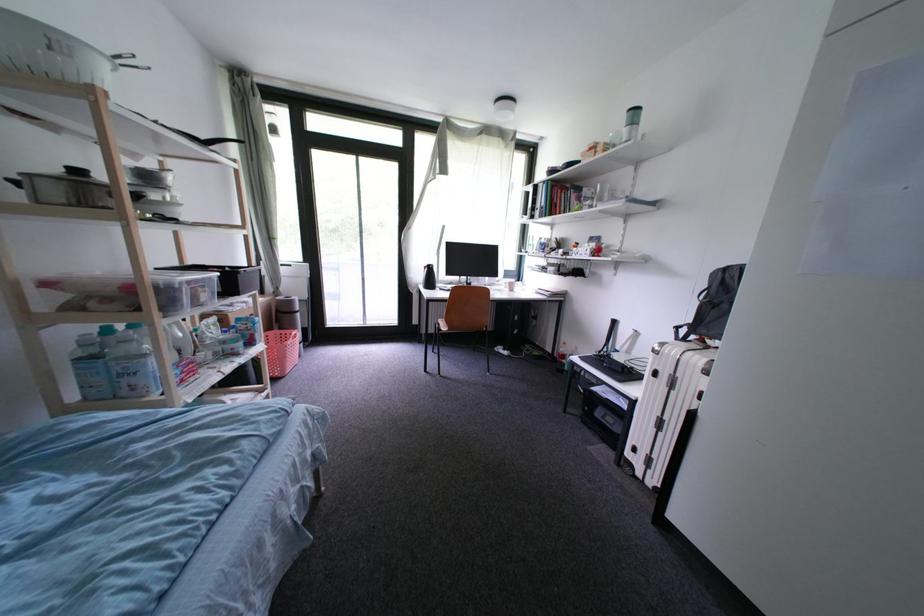
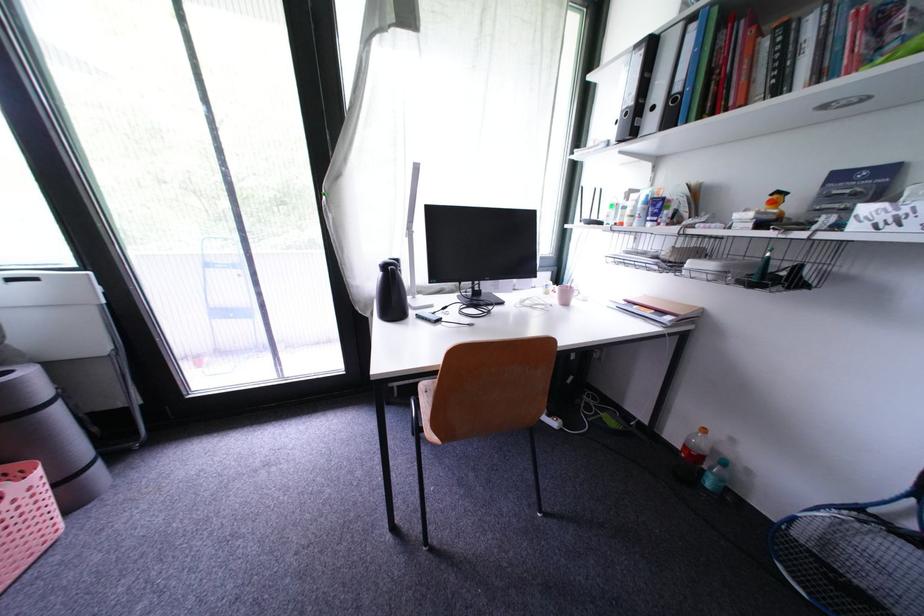
Question: Which direction would the cameraman need to move to produce the second image? Reply with the corresponding letter.

Choices:
 (A) Left
 (B) Right
 (C) Forward
 (D) Backward

Answer: (C)